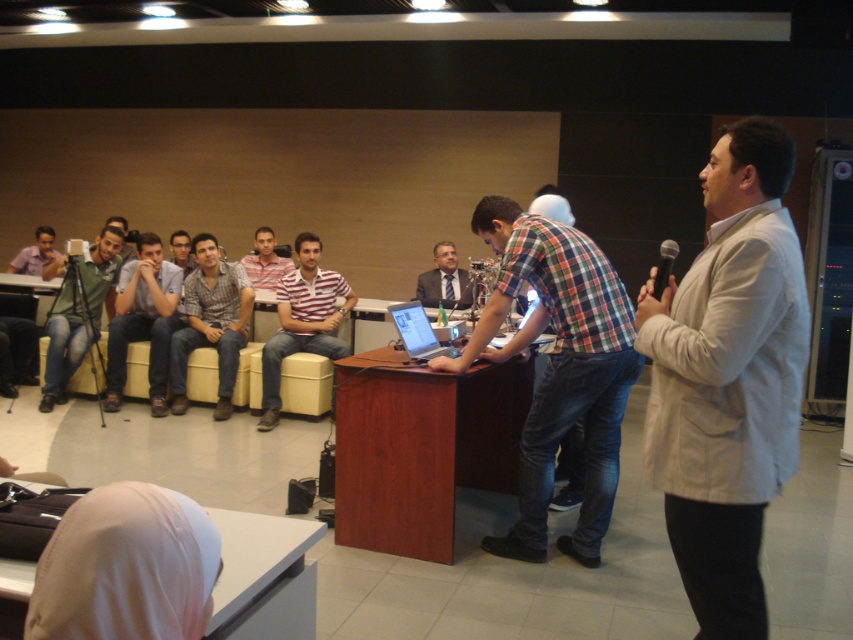
You are standing in the room and want to hand a document to the person wearing the matte green shirt at left. Based on their position, which direction should you walk to reach them?

The matte green shirt at left is located at point (79, 314) in the room, so you should walk towards the left side of the room to reach them.

You are organizing an event and need to place a 5 meter long banner between the beige fabric jacket at right and the black plastic microphone at upper right. Will the banner fit without overlapping either object?

The distance between the beige fabric jacket at right and the black plastic microphone at upper right is 4.62 meters. Since the banner is 5 meters long, it will be 0.38 meters too long and will overlap both objects.

You are organizing a small event and need to ensure that the beige fabric jacket at right and the black plastic microphone at upper right can fit side by side on a shelf. The shelf has a width of 1 meter. Can both items be placed next to each other without exceeding the shelf space?

The beige fabric jacket at right might be wider than black plastic microphone at upper right, but since the shelf is 1 meter wide, it is possible that both can fit if the combined width of the jacket and microphone does not exceed the shelf length. However, without exact measurements, we cannot confirm with certainty.